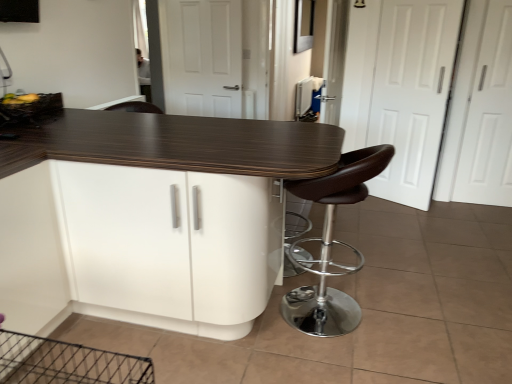
Question: Considering the relative sizes of wooden textured basket at upper left and white matte door at center, marked as the 3th screen door in a right-to-left arrangement, in the image provided, is wooden textured basket at upper left thinner than white matte door at center, marked as the 3th screen door in a right-to-left arrangement,?

Choices:
 (A) no
 (B) yes

Answer: (A)

Question: Considering the relative sizes of wooden textured basket at upper left and white matte door at center, which is the first screen door from left to right, in the image provided, is wooden textured basket at upper left bigger than white matte door at center, which is the first screen door from left to right,?

Choices:
 (A) yes
 (B) no

Answer: (B)

Question: Is wooden textured basket at upper left in front of white matte door at center, marked as the 3th screen door in a right-to-left arrangement?

Choices:
 (A) no
 (B) yes

Answer: (B)

Question: From a real-world perspective, is wooden textured basket at upper left physically above white matte door at center, marked as the 3th screen door in a right-to-left arrangement?

Choices:
 (A) no
 (B) yes

Answer: (A)

Question: Is wooden textured basket at upper left placed right next to white matte door at center, marked as the 3th screen door in a right-to-left arrangement?

Choices:
 (A) no
 (B) yes

Answer: (A)

Question: Is point (25, 119) closer or farther from the camera than point (216, 188)?

Choices:
 (A) farther
 (B) closer

Answer: (A)

Question: In the image, is wooden textured basket at upper left positioned in front of or behind white glossy cabinet at center?

Choices:
 (A) front
 (B) behind

Answer: (B)

Question: Based on their positions, is wooden textured basket at upper left located to the left or right of white glossy cabinet at center?

Choices:
 (A) left
 (B) right

Answer: (A)

Question: Considering the positions of wooden textured basket at upper left and white glossy cabinet at center in the image, is wooden textured basket at upper left wider or thinner than white glossy cabinet at center?

Choices:
 (A) wide
 (B) thin

Answer: (B)

Question: Based on their sizes in the image, would you say white matte screen door at right, acting as the first screen door starting from the right, is bigger or smaller than white matte door at right, placed as the second screen door when sorted from left to right?

Choices:
 (A) small
 (B) big

Answer: (B)

Question: Would you say white matte screen door at right, the 3th screen door viewed from the left, is inside or outside white matte door at right, the 2th screen door from the right?

Choices:
 (A) outside
 (B) inside

Answer: (A)

Question: From the image's perspective, is white matte screen door at right, acting as the first screen door starting from the right, positioned above or below white matte door at right, placed as the second screen door when sorted from left to right?

Choices:
 (A) above
 (B) below

Answer: (B)

Question: Looking at their shapes, would you say white matte screen door at right, the 3th screen door viewed from the left, is wider or thinner than white matte door at right, the 2th screen door from the right?

Choices:
 (A) thin
 (B) wide

Answer: (B)

Question: From the image's perspective, is wooden textured basket at upper left positioned above or below brown leather stool at right?

Choices:
 (A) above
 (B) below

Answer: (A)

Question: Considering their positions, is wooden textured basket at upper left located in front of or behind brown leather stool at right?

Choices:
 (A) front
 (B) behind

Answer: (B)